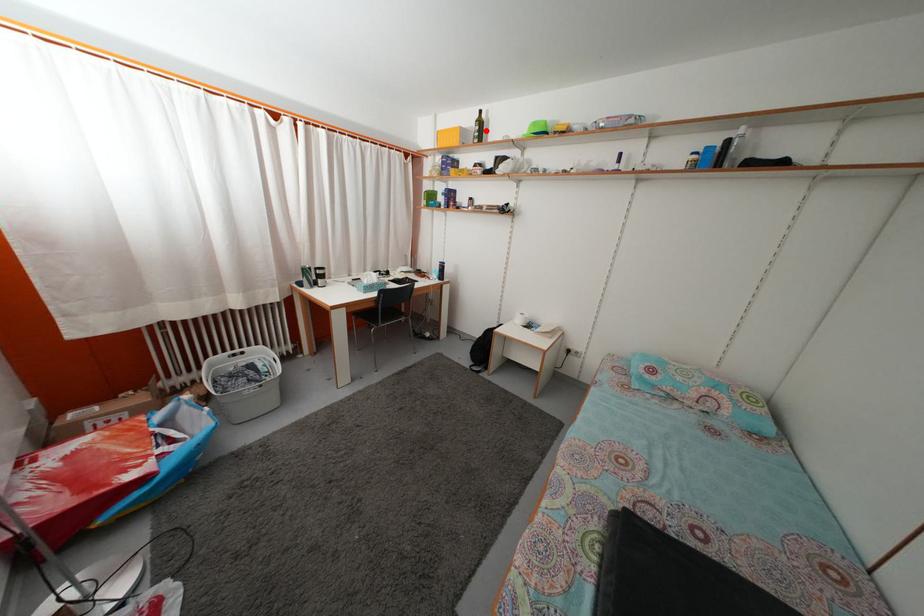
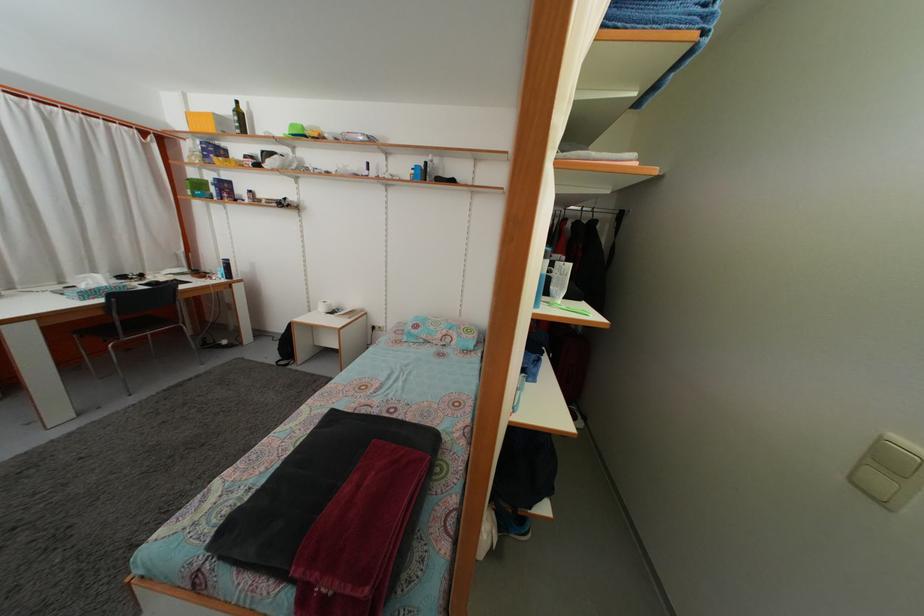
Question: I am providing you with two images of the same scene from different viewpoints. Given a red point in image1, look at the same physical point in image2. Is it:

Choices:
 (A) Closer to the viewpoint
 (B) Farther from the viewpoint

Answer: (B)